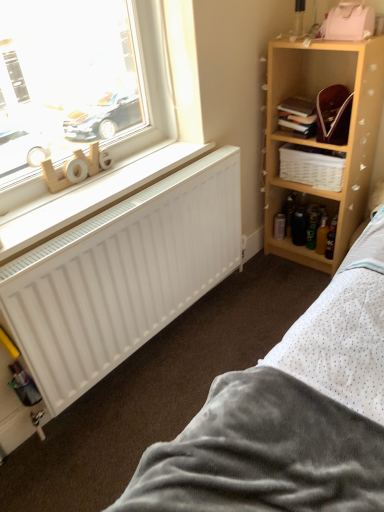
Find the location of a particular element. vacant space in front of wooden letters at window is located at coordinates (66, 203).